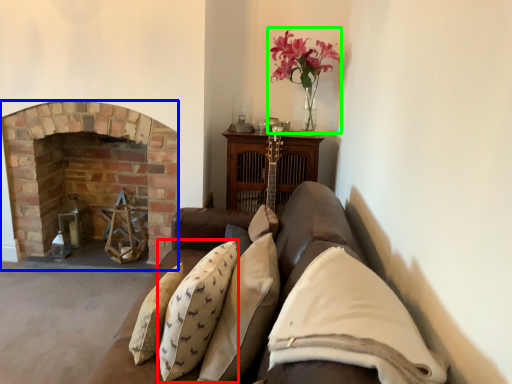
Question: Based on their relative distances, which object is nearer to pillow (highlighted by a red box)? Choose from fireplace (highlighted by a blue box) and floral arrangement (highlighted by a green box).

Choices:
 (A) fireplace
 (B) floral arrangement

Answer: (B)